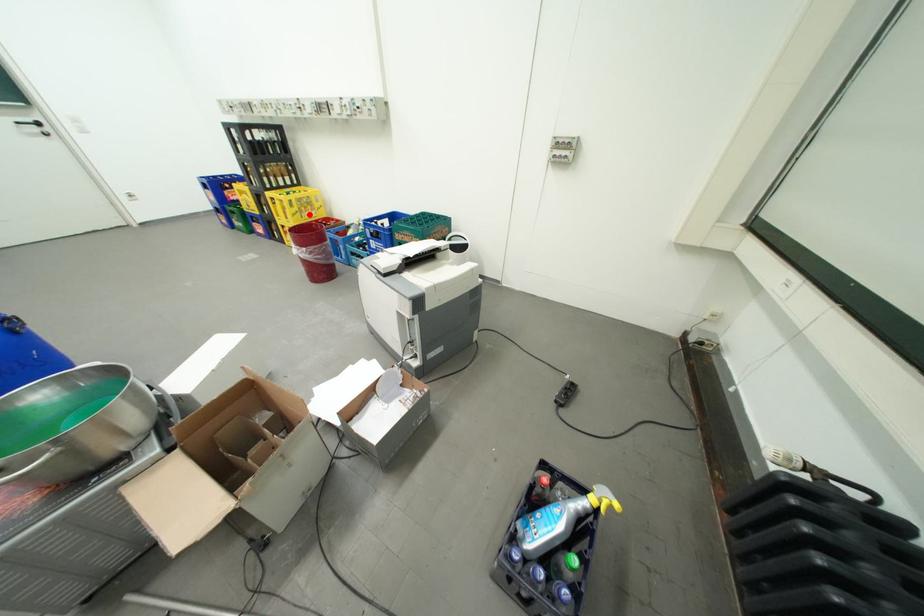
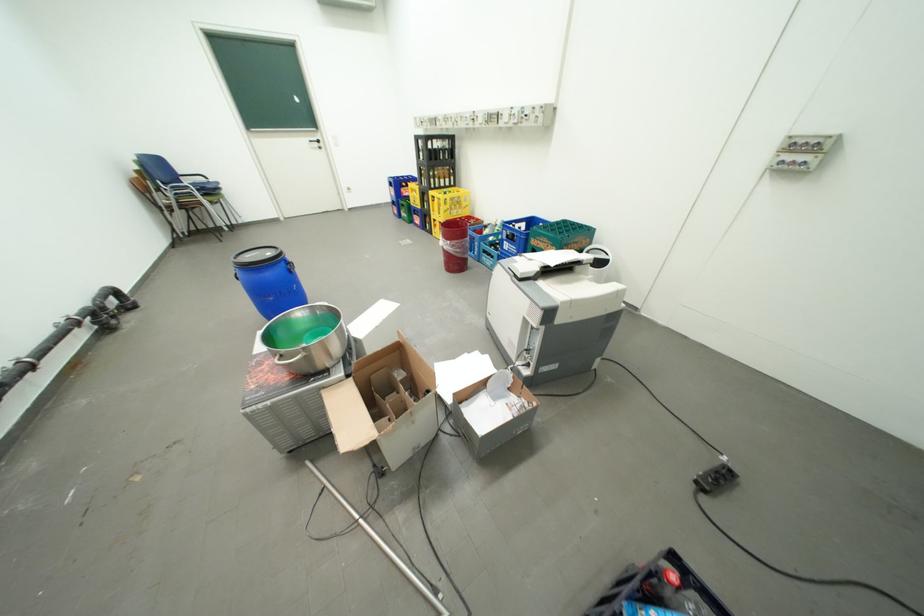
Question: I am providing you with two images of the same scene from different viewpoints. Image1 has a red point marked. In image2, the corresponding 3D location appears at what relative position? Reply with the corresponding letter.

Choices:
 (A) Closer
 (B) Farther

Answer: (B)